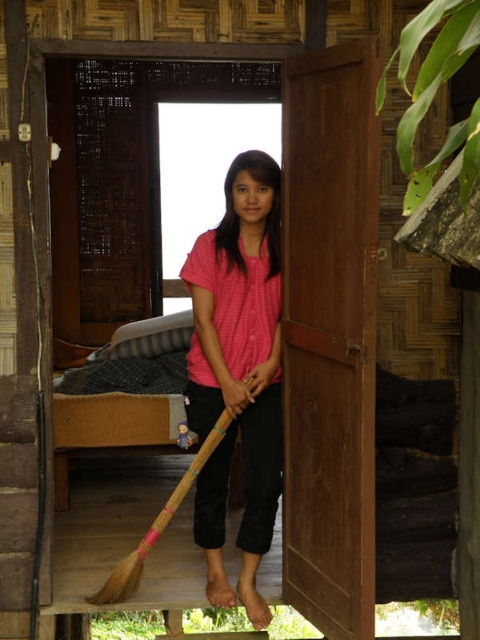
You are trying to carry the bamboo broom at center through the brown wooden door at center. Will it fit through the doorway?

The brown wooden door at center is narrower than the bamboo broom at center, so the broom will not fit through the doorway.

In the scene shown: You are a visitor approaching the brown wooden door at center and the bamboo broom at center in the image. Which object would you encounter first as you move towards them?

The brown wooden door at center is in front of the bamboo broom at center, so you would encounter the brown wooden door at center first.

You are standing in front of the rustic wooden cabin and want to place a decoration at the point that is exactly 3.12 meters away from where you are standing. Which point from the list below should you choose? The available points are point A at coordinates 0.650, 0.400, point B at (211,464), point C at 0.800, 0.500, and point D at 0.700, 0.420.

You should choose point B at (211,464) because it is exactly 3.12 meters away from the viewer, as stated in the description.